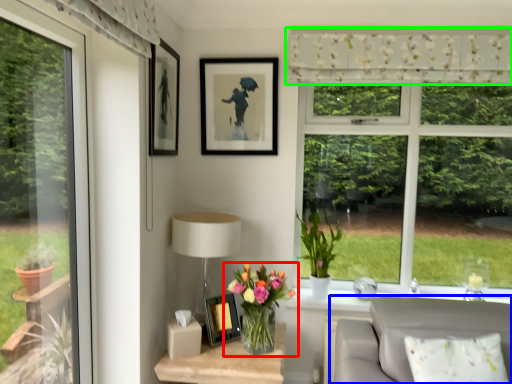
Question: Which is nearer to the houseplant (highlighted by a red box)? studio couch (highlighted by a blue box) or curtain (highlighted by a green box).

Choices:
 (A) studio couch
 (B) curtain

Answer: (A)